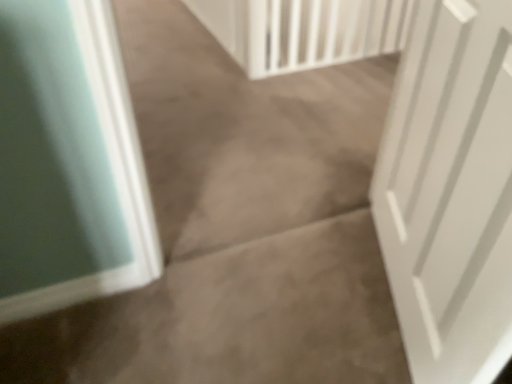
Describe the element at coordinates (450, 192) in the screenshot. Image resolution: width=512 pixels, height=384 pixels. I see `white smooth door at right` at that location.

At what (x,y) coordinates should I click in order to perform the action: click on white smooth door at right. Please return your answer as a coordinate pair (x, y). The width and height of the screenshot is (512, 384). Looking at the image, I should click on (450, 192).

Where is `white smooth door at right`? white smooth door at right is located at coordinates (450, 192).